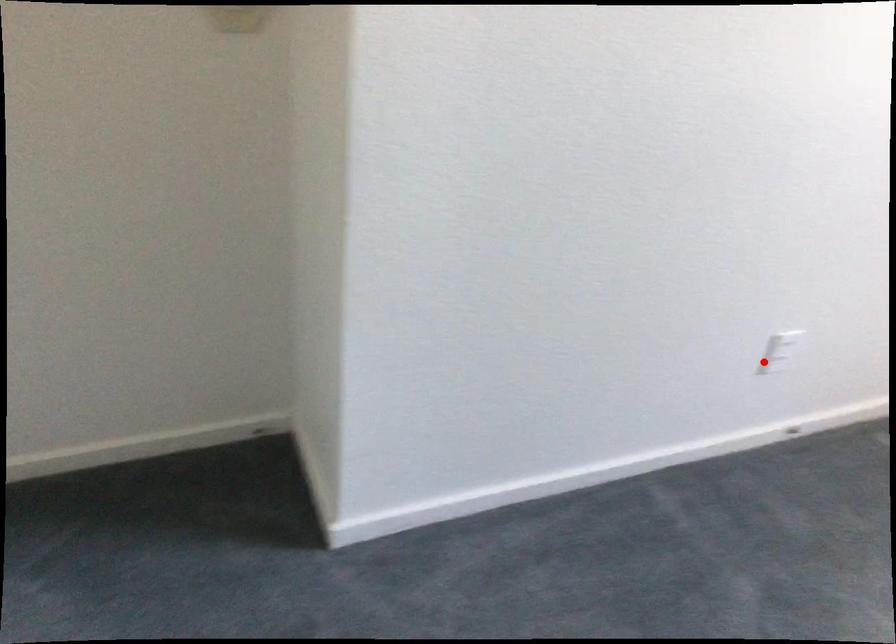
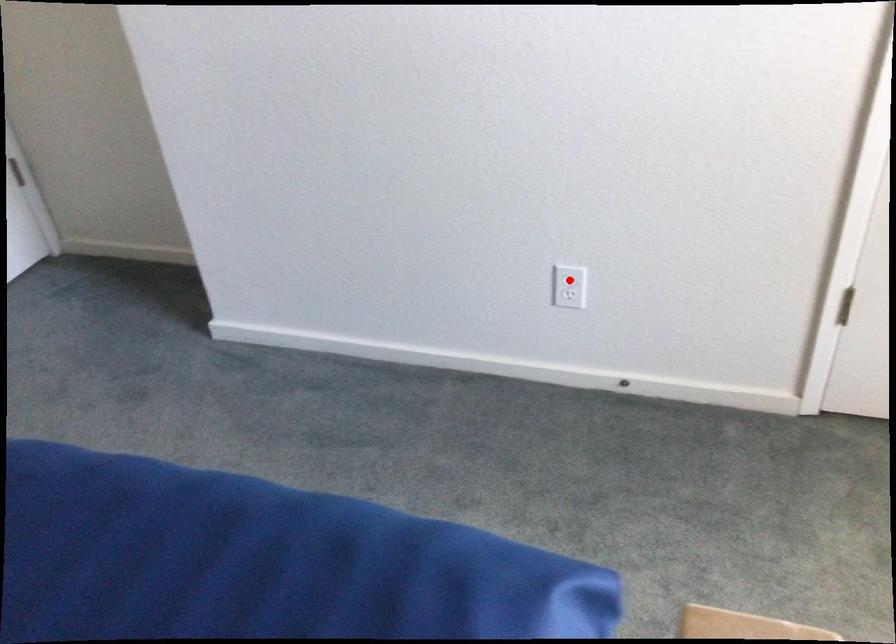
I am providing you with two images of the same scene from different viewpoints. A red point is marked on the first image and another point is marked on the second image. Do the highlighted points in image1 and image2 indicate the same real-world spot?

No